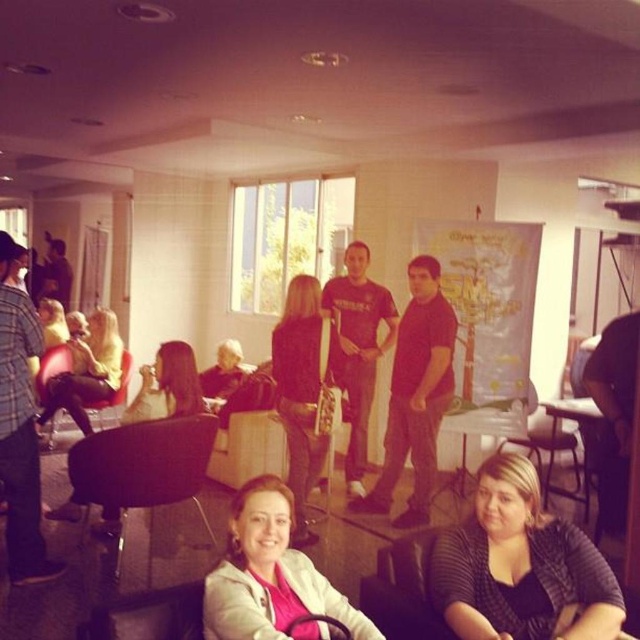
Is point (300, 518) behind point (218, 374)?

That is False.

Which of these two, black leather jacket at center or matte black hairdryer at center, stands shorter?

Standing shorter between the two is matte black hairdryer at center.

Which is behind, point (288, 355) or point (214, 374)?

Point (214, 374)

Identify the location of black leather jacket at center. (301, 388).

Does striped sweater at lower right have a greater height compared to pink matte jacket at lower center?

Correct, striped sweater at lower right is much taller as pink matte jacket at lower center.

Between point (493, 468) and point (269, 484), which one is positioned behind?

The point (493, 468) is behind.

Does point (476, 627) lie behind point (256, 506)?

Yes, point (476, 627) is farther from viewer.

Locate an element on the screen. Image resolution: width=640 pixels, height=640 pixels. striped sweater at lower right is located at coordinates (518, 564).

In order to click on pink matte jacket at lower center in this screenshot , I will do `click(272, 577)`.

Is pink matte jacket at lower center to the right of matte black chair at lower center from the viewer's perspective?

No, pink matte jacket at lower center is not to the right of matte black chair at lower center.

You are a GUI agent. You are given a task and a screenshot of the screen. Output one action in this format:
    pyautogui.click(x=<x>, y=<y>)
    Task: Click on the pink matte jacket at lower center
    This screenshot has height=640, width=640.
    Given the screenshot: What is the action you would take?
    pyautogui.click(x=272, y=577)

The height and width of the screenshot is (640, 640). I want to click on pink matte jacket at lower center, so click(x=272, y=577).